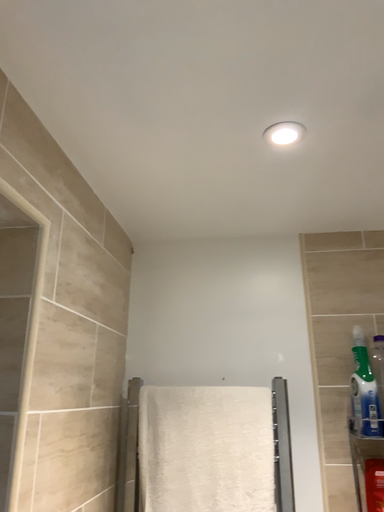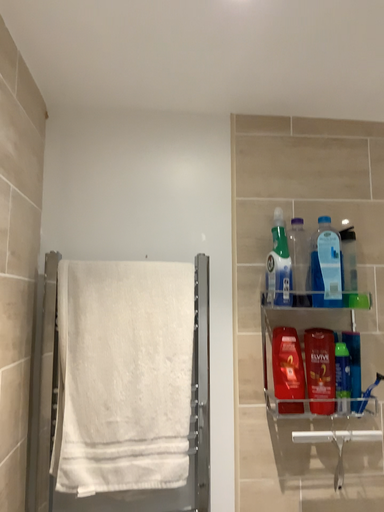
Question: How did the camera likely rotate when shooting the video?

Choices:
 (A) rotated downward
 (B) rotated upward

Answer: (A)